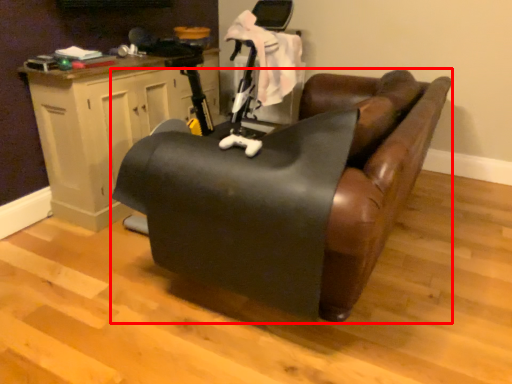
Question: From the image's perspective, considering the relative positions of furniture (annotated by the red box) and table in the image provided, where is furniture (annotated by the red box) located with respect to the staircase?

Choices:
 (A) above
 (B) below

Answer: (B)